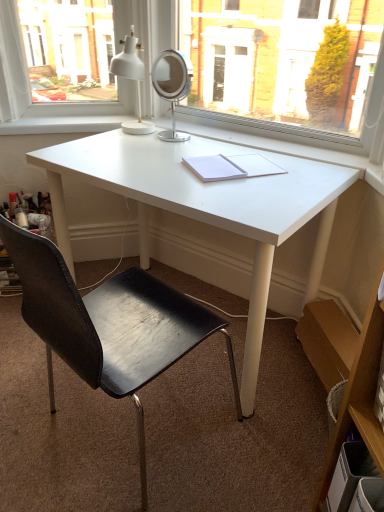
Question: Considering the relative sizes of wooden shelf at right and white matte table lamp at upper center in the image provided, is wooden shelf at right wider than white matte table lamp at upper center?

Choices:
 (A) no
 (B) yes

Answer: (B)

Question: Considering the relative positions of wooden shelf at right and white matte table lamp at upper center in the image provided, is wooden shelf at right to the left of white matte table lamp at upper center from the viewer's perspective?

Choices:
 (A) yes
 (B) no

Answer: (B)

Question: Could you tell me if wooden shelf at right is turned towards white matte table lamp at upper center?

Choices:
 (A) no
 (B) yes

Answer: (A)

Question: Considering the relative sizes of wooden shelf at right and white matte table lamp at upper center in the image provided, is wooden shelf at right smaller than white matte table lamp at upper center?

Choices:
 (A) no
 (B) yes

Answer: (A)

Question: Considering the relative sizes of wooden shelf at right and white matte table lamp at upper center in the image provided, is wooden shelf at right bigger than white matte table lamp at upper center?

Choices:
 (A) no
 (B) yes

Answer: (B)

Question: Considering the positions of point (132, 66) and point (377, 372), is point (132, 66) closer or farther from the camera than point (377, 372)?

Choices:
 (A) farther
 (B) closer

Answer: (A)

Question: In terms of height, does white matte table lamp at upper center look taller or shorter compared to wooden shelf at right?

Choices:
 (A) short
 (B) tall

Answer: (A)

Question: From a real-world perspective, relative to wooden shelf at right, is white matte table lamp at upper center vertically above or below?

Choices:
 (A) above
 (B) below

Answer: (A)

Question: Considering the positions of white matte table lamp at upper center and wooden shelf at right in the image, is white matte table lamp at upper center wider or thinner than wooden shelf at right?

Choices:
 (A) thin
 (B) wide

Answer: (A)

Question: From the image's perspective, relative to white paper notebook at center, is wooden shelf at right above or below?

Choices:
 (A) above
 (B) below

Answer: (B)

Question: From a real-world perspective, is wooden shelf at right above or below white paper notebook at center?

Choices:
 (A) below
 (B) above

Answer: (A)

Question: Is wooden shelf at right inside the boundaries of white paper notebook at center, or outside?

Choices:
 (A) inside
 (B) outside

Answer: (B)

Question: In terms of width, does wooden shelf at right look wider or thinner when compared to white paper notebook at center?

Choices:
 (A) wide
 (B) thin

Answer: (B)

Question: Considering the positions of white paper notebook at center and black leather chair at center in the image, is white paper notebook at center bigger or smaller than black leather chair at center?

Choices:
 (A) small
 (B) big

Answer: (A)

Question: From the image's perspective, is white paper notebook at center located above or below black leather chair at center?

Choices:
 (A) below
 (B) above

Answer: (B)